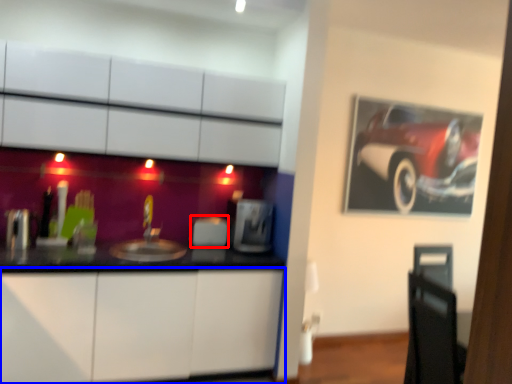
Question: Which object is closer to the camera taking this photo, appliance (highlighted by a red box) or cabinetry (highlighted by a blue box)?

Choices:
 (A) appliance
 (B) cabinetry

Answer: (B)